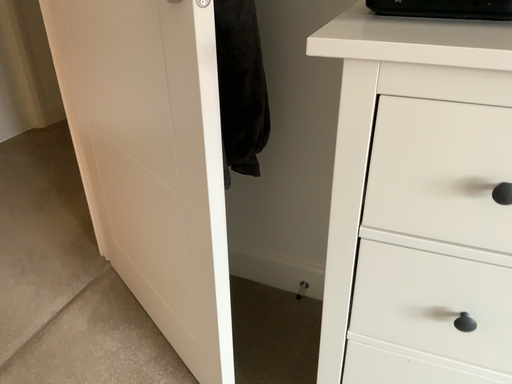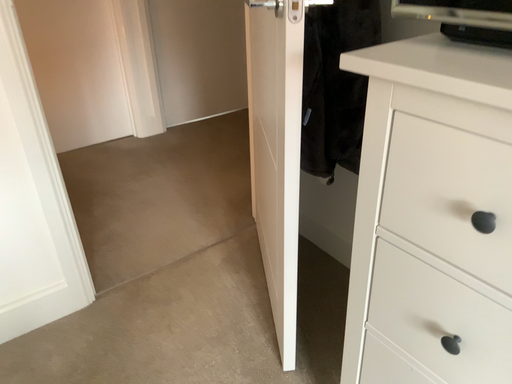
Question: Which way did the camera rotate in the video?

Choices:
 (A) rotated left
 (B) rotated right

Answer: (A)